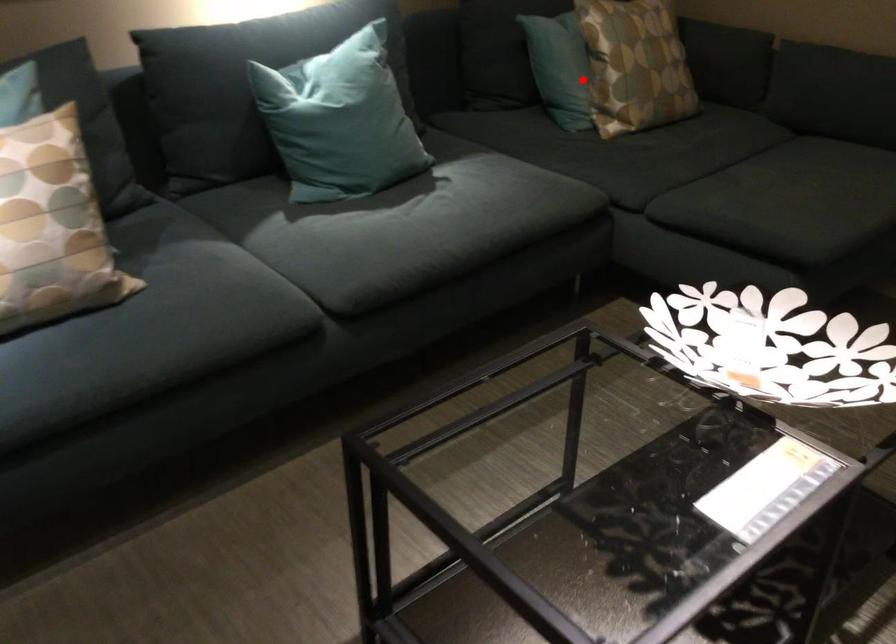
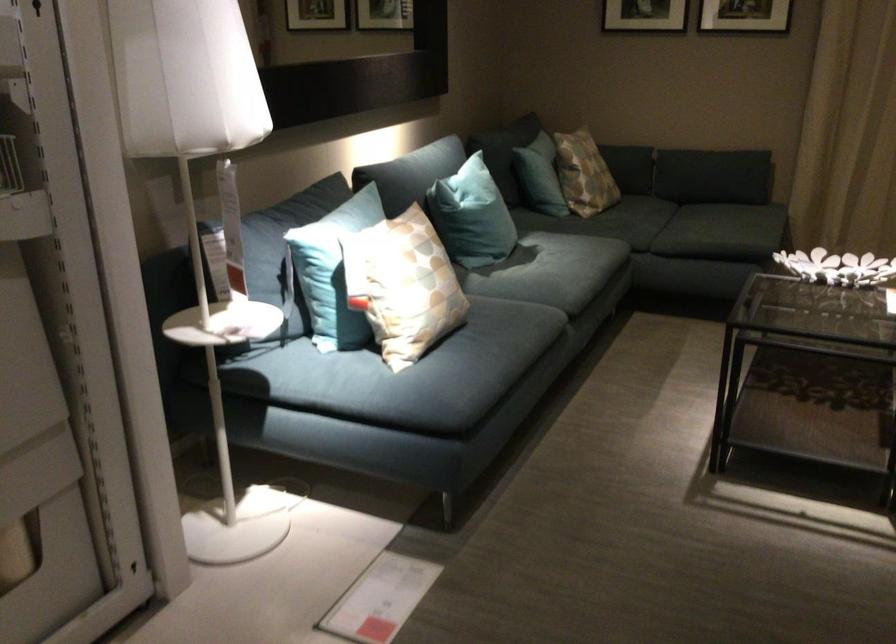
In the second image, find the point that corresponds to the highlighted location in the first image.

(583, 174)